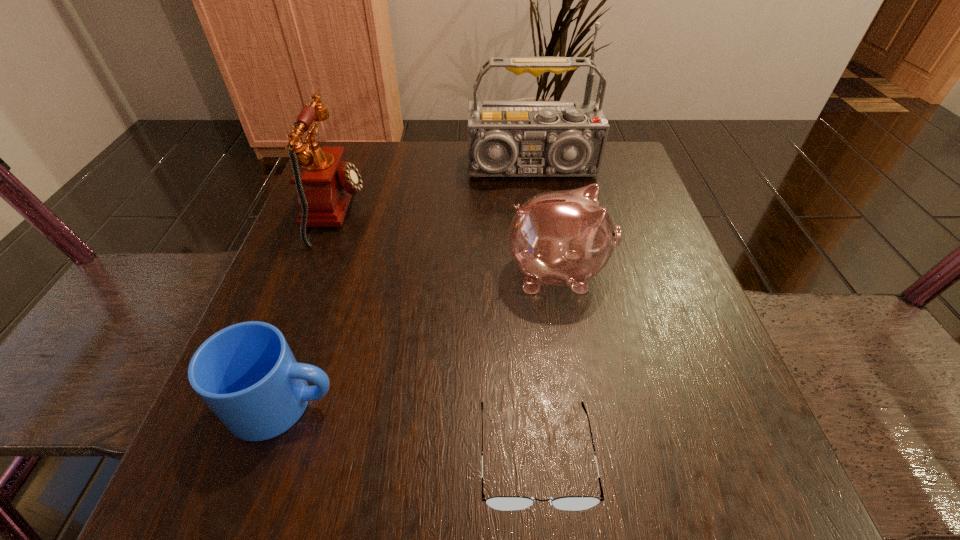
Find the location of a particular element. This screenshot has height=540, width=960. the tallest object is located at coordinates (505, 138).

This screenshot has width=960, height=540. I want to click on the second tallest object, so click(x=325, y=183).

The image size is (960, 540). I want to click on piggy bank, so click(563, 238).

This screenshot has width=960, height=540. What are the coordinates of `the second shortest object` in the screenshot? It's located at (246, 373).

Find the location of a particular element. The height and width of the screenshot is (540, 960). spectacles is located at coordinates (504, 503).

At what (x,y) coordinates should I click in order to perform the action: click on blank space located on the front-facing side of the radio receiver. Please return your answer as a coordinate pair (x, y). The height and width of the screenshot is (540, 960). Looking at the image, I should click on (543, 248).

The width and height of the screenshot is (960, 540). Identify the location of free location located on the dial of the telephone. (450, 212).

The image size is (960, 540). Identify the location of free space located 0.100m on the front facing side of the third tallest object. (664, 272).

Identify the location of free space located on the side of the mug with the handle. (538, 403).

Locate an element on the screen. The width and height of the screenshot is (960, 540). radio receiver positioned at the far edge is located at coordinates (505, 138).